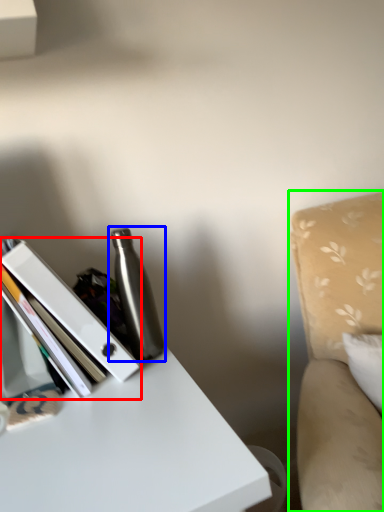
Question: Based on their relative distances, which object is farther from book (highlighted by a red box)? Choose from bottle (highlighted by a blue box) and swivel chair (highlighted by a green box).

Choices:
 (A) bottle
 (B) swivel chair

Answer: (B)